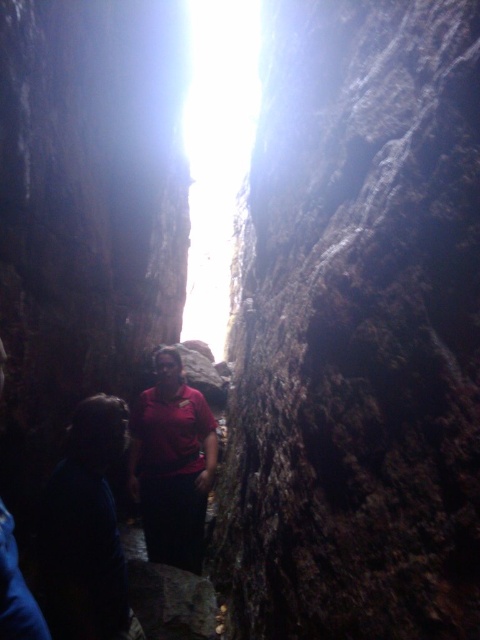
You are a hiker trying to exit the narrow rocky passage. You see a dark blue shirt at left and a matte red shirt at center. Which direction should you move to reach the bright light at the far end?

The dark blue shirt at left is positioned on the left side of matte red shirt at center. To reach the bright light at the far end, you should move towards the center where the matte red shirt is located, as it is closer to the path leading to the exit.

You are a hiker planning to walk through the narrow rocky passage. You see the dark blue shirt at left and the matte red shirt at center ahead of you. If you want to pass between them without getting too close, is there enough space? The passage is only 8 feet wide.

The dark blue shirt at left and matte red shirt at center are 7.35 feet apart, so there is enough space between them for you to pass through since the distance between them is less than the passage width of 8 feet.

You are standing at the entrance of the passage and want to locate the dark blue shirt at left. According to the coordinates provided, where should you look relative to the center of the image?

The dark blue shirt at left is located at point 0.828 on the x axis and 0.179 on the y axis, which is to the right and slightly above the center of the image.